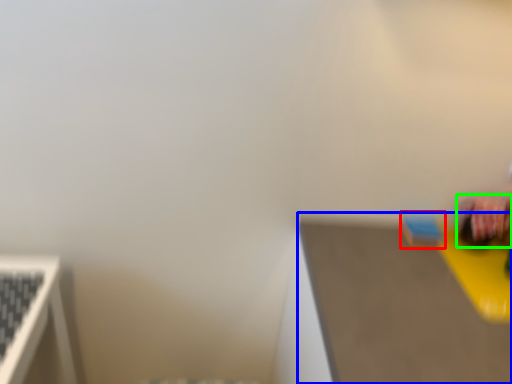
Question: Which is farther away from toy (highlighted by a red box)? table top (highlighted by a blue box) or toy (highlighted by a green box)?

Choices:
 (A) table top
 (B) toy

Answer: (A)